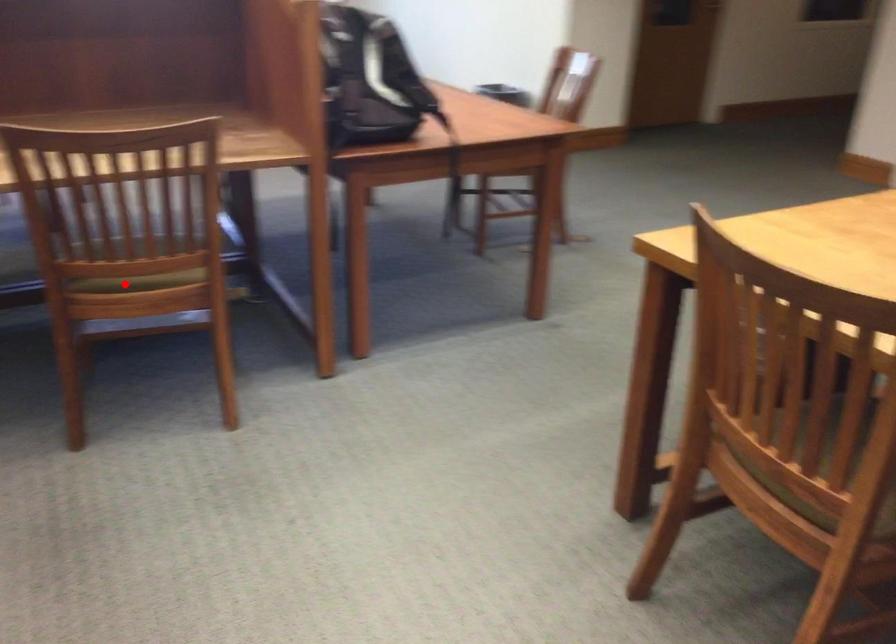
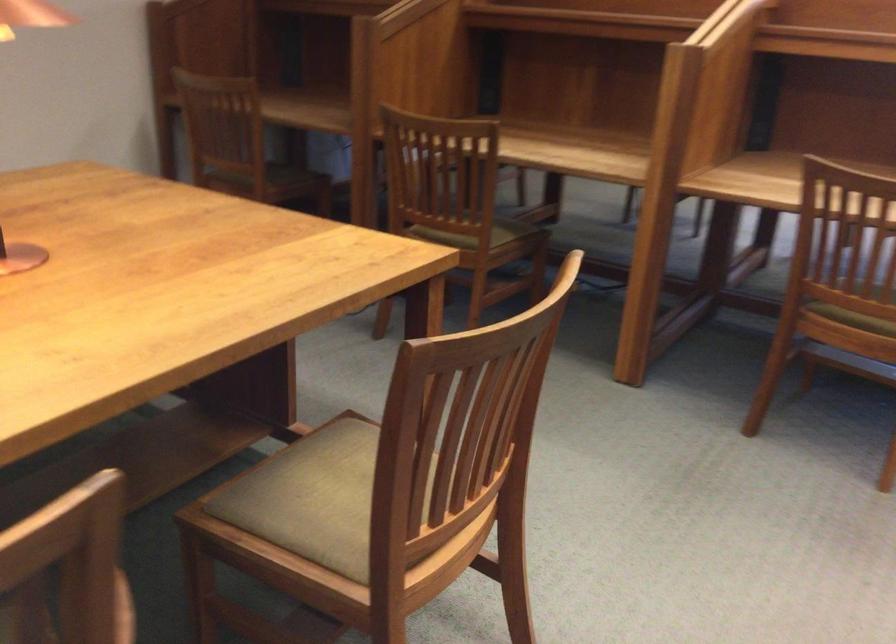
Where in the second image is the point corresponding to the highlighted location from the first image?

(855, 313)